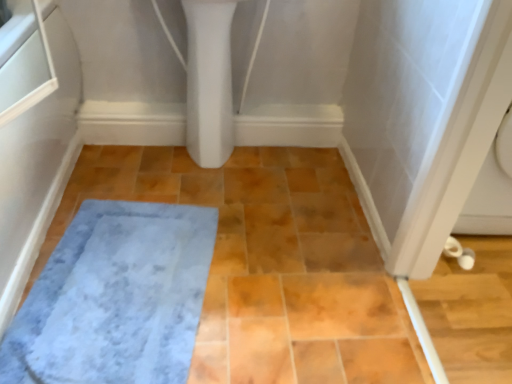
Question: From a real-world perspective, is gray plush bath mat at lower left above or below white glossy bidet at upper center?

Choices:
 (A) below
 (B) above

Answer: (A)

Question: In terms of width, does gray plush bath mat at lower left look wider or thinner when compared to white glossy bidet at upper center?

Choices:
 (A) thin
 (B) wide

Answer: (B)

Question: Considering their positions, is gray plush bath mat at lower left located in front of or behind white glossy bidet at upper center?

Choices:
 (A) behind
 (B) front

Answer: (B)

Question: In the image, is white glossy bidet at upper center on the left side or the right side of gray plush bath mat at lower left?

Choices:
 (A) left
 (B) right

Answer: (B)

Question: Considering the positions of white glossy bidet at upper center and gray plush bath mat at lower left in the image, is white glossy bidet at upper center bigger or smaller than gray plush bath mat at lower left?

Choices:
 (A) big
 (B) small

Answer: (A)

Question: Is white glossy bidet at upper center inside or outside of gray plush bath mat at lower left?

Choices:
 (A) outside
 (B) inside

Answer: (A)

Question: From the image's perspective, is white glossy bidet at upper center above or below gray plush bath mat at lower left?

Choices:
 (A) below
 (B) above

Answer: (B)